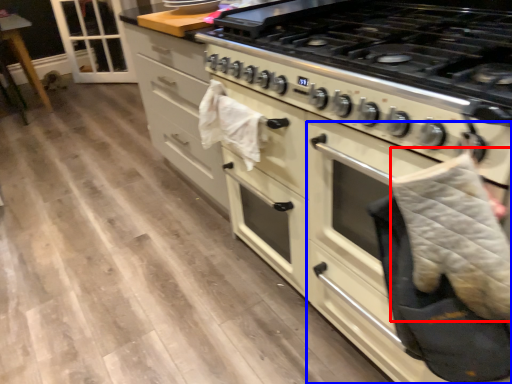
Question: Among these objects, which one is farthest to the camera, blanket (highlighted by a red box) or oven (highlighted by a blue box)?

Choices:
 (A) blanket
 (B) oven

Answer: (A)